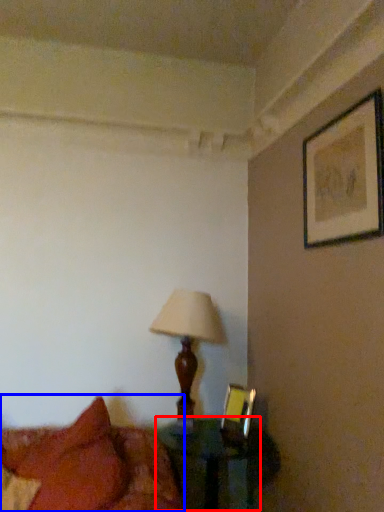
Question: Which of the following is the closest to the observer, table (highlighted by a red box) or bed (highlighted by a blue box)?

Choices:
 (A) table
 (B) bed

Answer: (B)